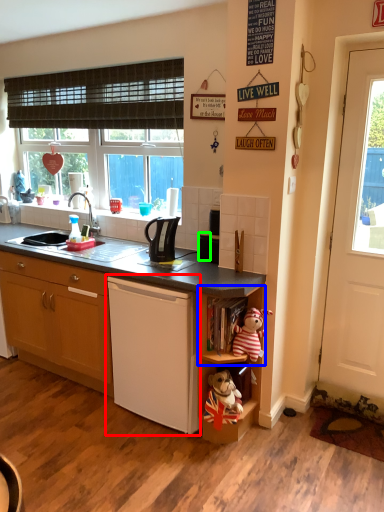
Question: Which object is the farthest from home appliance (highlighted by a red box)? Choose among these: shelf (highlighted by a blue box) or appliance (highlighted by a green box).

Choices:
 (A) shelf
 (B) appliance

Answer: (B)